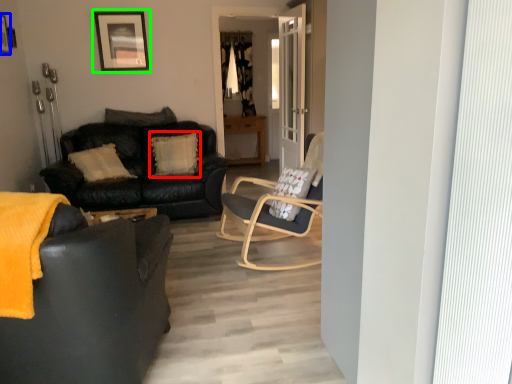
Question: Which object is the closest to the pillow (highlighted by a red box)? Choose among these: picture frame (highlighted by a blue box) or picture frame (highlighted by a green box).

Choices:
 (A) picture frame
 (B) picture frame

Answer: (B)